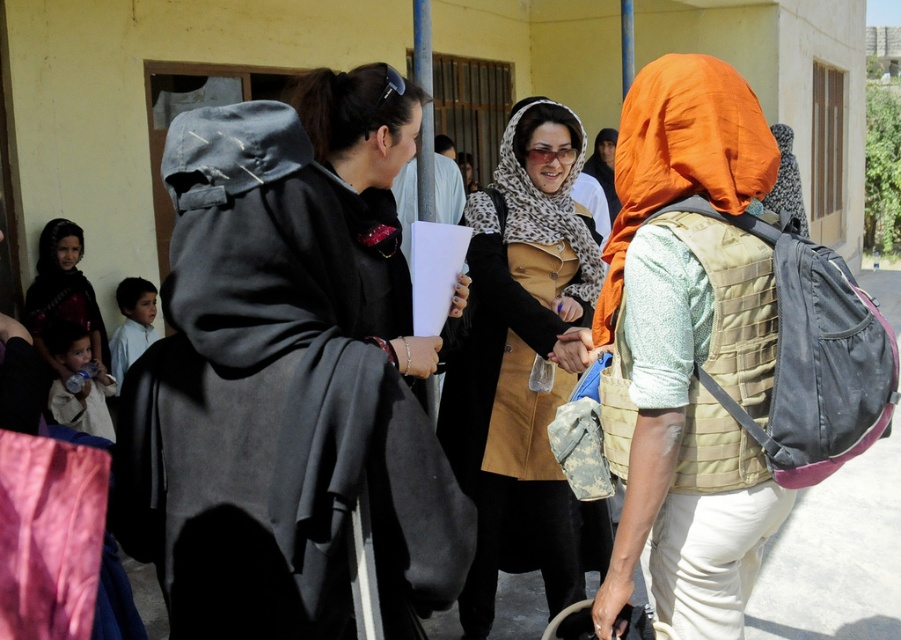
You are organizing a photo shoot and need to ensure that the dark gray woolen robe at center and the orange fabric headscarf at center are both visible in the frame. Given their sizes, which object should you prioritize positioning closer to the camera to ensure it doesn

The dark gray woolen robe at center is wider than the orange fabric headscarf at center, so you should prioritize positioning the dark gray woolen robe at center closer to the camera to ensure it is fully visible in the frame.

In the scene described, there are two fabrics at the center of the image. The orange fabric headscarf at center and the leopard print fabric at center. Which fabric takes up more space in the image?

The leopard print fabric at center occupies more space than the orange fabric headscarf at center.

You are organizing a community event and need to identify the most visible fabric patterns in the group. Which fabric is thinner between the orange fabric headscarf at center and the leopard print fabric at center?

The orange fabric headscarf at center is thinner than the leopard print fabric at center.